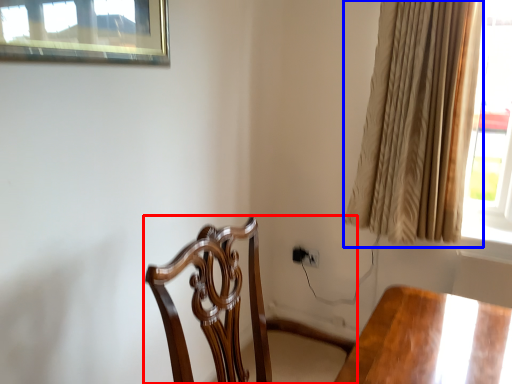
Question: Among these objects, which one is nearest to the camera, chair (highlighted by a red box) or curtain (highlighted by a blue box)?

Choices:
 (A) chair
 (B) curtain

Answer: (A)